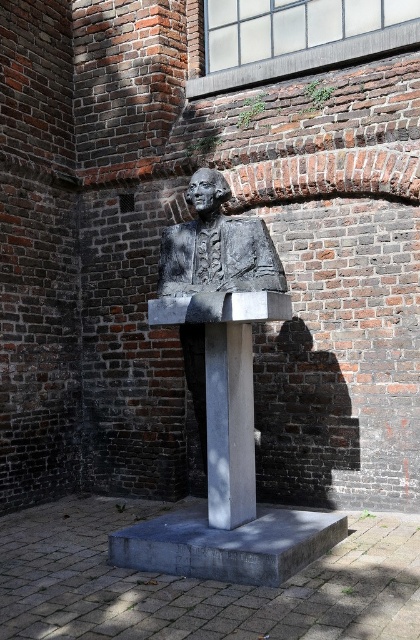
You are an art curator standing in front of the bronze bust at center and the bronze statue at center. You notice that the pedestal has a height of 1.2 meters. Can you determine which object is closer to the ground?

The bronze bust at center is located below the bronze statue at center, so the bronze bust at center is closer to the ground.

You are standing in front of a sculpture display and see both the bronze bust at center and the bronze statue at center. Which one is positioned closer to you?

The bronze bust at center is closer to the viewer than the bronze statue at center.

You are standing in front of the bronze bust sculpture and need to determine which of the two points, point (225,193) or point (194,272), is nearer to you. Based on the spatial relationship between them, which point should you choose?

Point (225,193) is closer to the viewer than point (194,272), so you should choose point (225,193).